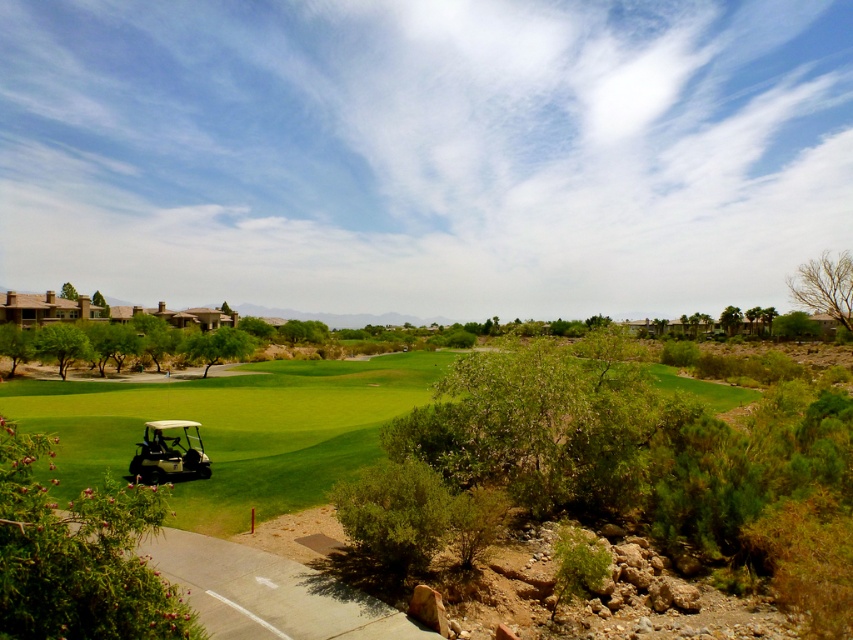
Who is positioned more to the right, white plastic golf cart at lower left or white matte golf cart at lower left?

Positioned to the right is white plastic golf cart at lower left.

Locate an element on the screen. This screenshot has height=640, width=853. white plastic golf cart at lower left is located at coordinates (233, 429).

The width and height of the screenshot is (853, 640). Find the location of `white plastic golf cart at lower left`. white plastic golf cart at lower left is located at coordinates (233, 429).